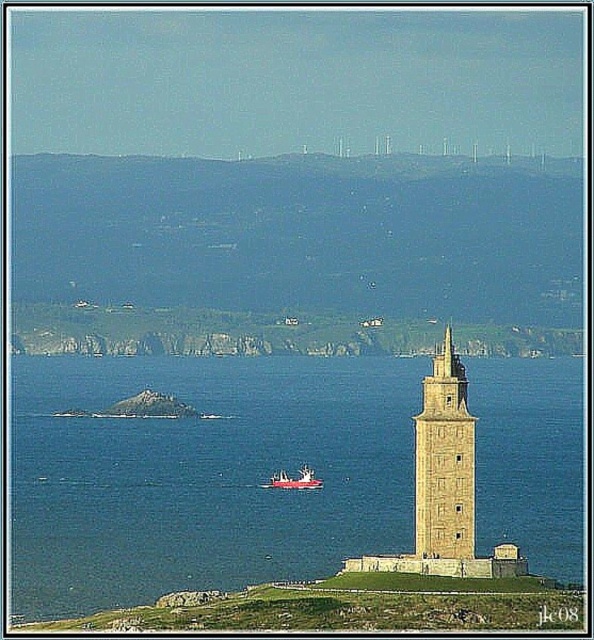
Looking at this image, who is more forward, [466,436] or [320,486]?

Point [320,486]

Can you confirm if beige stone tower at center is shorter than red plastic boat at center?

No.

Measure the distance between beige stone tower at center and camera.

beige stone tower at center and camera are 645.12 meters apart.

In order to click on beige stone tower at center in this screenshot , I will do `click(444, 461)`.

Does blue water at center appear over red plastic boat at center?

Yes.

Is blue water at center taller than red plastic boat at center?

Correct, blue water at center is much taller as red plastic boat at center.

Who is more distant from viewer, [369,432] or [312,481]?

Point [369,432]

I want to click on blue water at center, so click(x=204, y=474).

How far apart are blue water at center and beige stone tower at center?

The distance of blue water at center from beige stone tower at center is 113.94 feet.

Which is in front, point (68, 378) or point (424, 488)?

Point (424, 488) is in front.

This screenshot has height=640, width=594. Find the location of `blue water at center`. blue water at center is located at coordinates (204, 474).